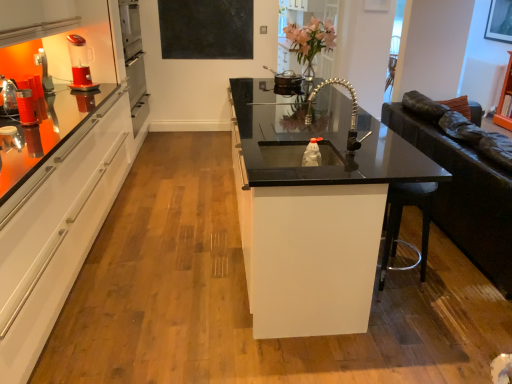
Identify the location of vacant space positioned to the left of black glass countertop at center. (166, 232).